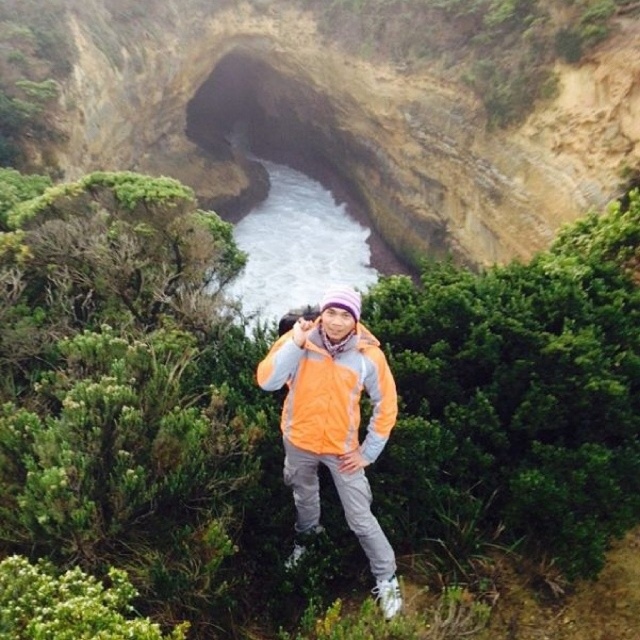
Question: Is the position of orange fabric jacket at center less distant than that of white frothy water at center?

Choices:
 (A) yes
 (B) no

Answer: (A)

Question: Which object appears closest to the camera in this image?

Choices:
 (A) white frothy water at center
 (B) orange fabric jacket at center

Answer: (B)

Question: Among these objects, which one is nearest to the camera?

Choices:
 (A) white frothy water at center
 (B) orange fleece jacket at center

Answer: (B)

Question: Does orange fabric jacket at center appear over orange fleece jacket at center?

Choices:
 (A) no
 (B) yes

Answer: (A)

Question: Which object is the farthest from the orange fleece jacket at center?

Choices:
 (A) orange fabric jacket at center
 (B) white frothy water at center

Answer: (B)

Question: Is the position of white frothy water at center more distant than that of orange fleece jacket at center?

Choices:
 (A) no
 (B) yes

Answer: (B)